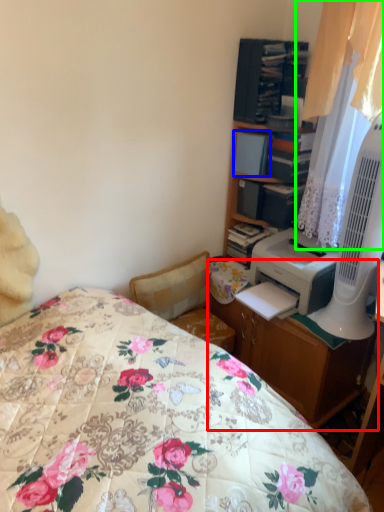
Question: Which object is the closest to the desk (highlighted by a red box)? Choose among these: book (highlighted by a blue box) or curtain (highlighted by a green box).

Choices:
 (A) book
 (B) curtain

Answer: (B)